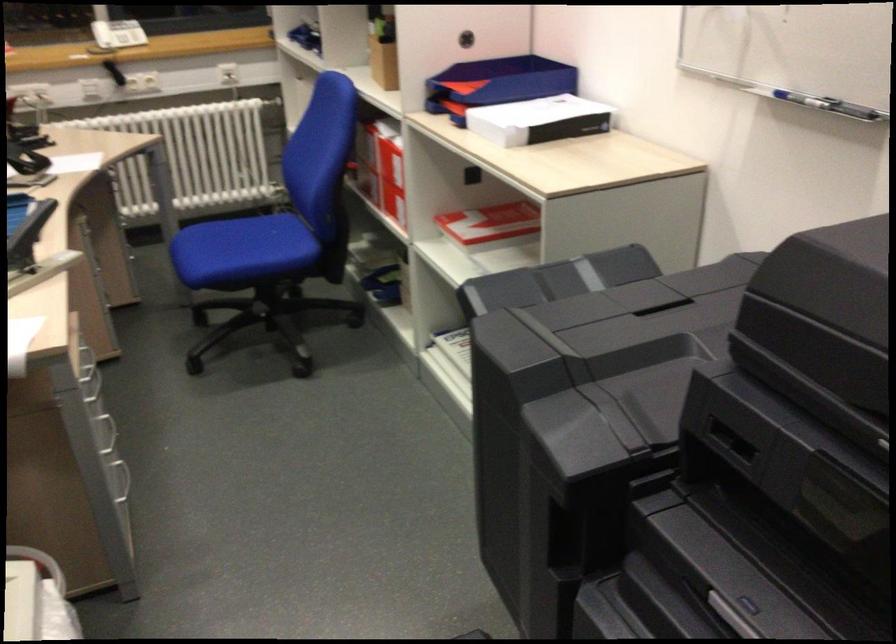
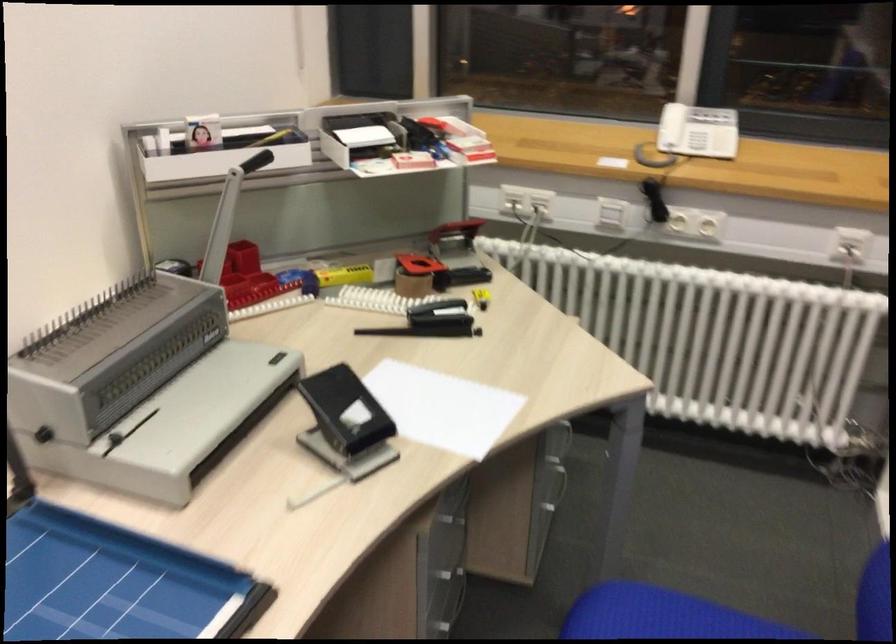
In the second image, find the point that corresponds to [246,229] in the first image.

(713, 611)